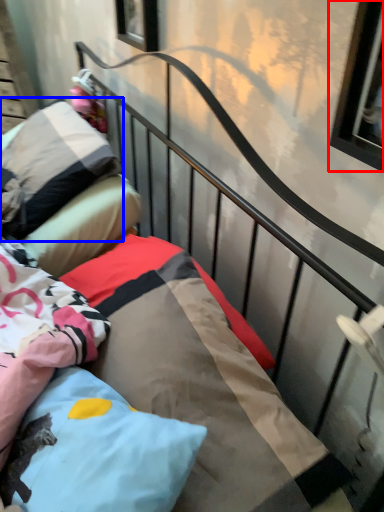
Question: Which point is closer to the camera, window (highlighted by a red box) or pillow (highlighted by a blue box)?

Choices:
 (A) window
 (B) pillow

Answer: (A)